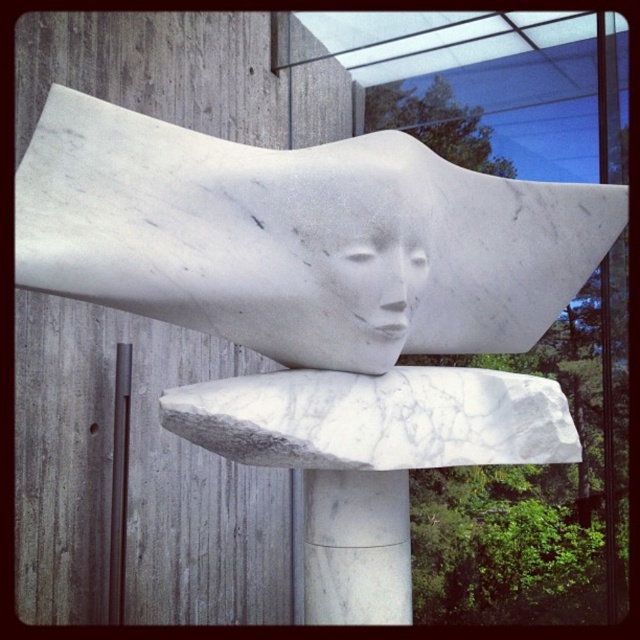
You are an art student analyzing the sculpture. You observe the white marble sculpture at center and the white marble face at center. Which one takes up more space in the image?

The white marble sculpture at center is larger in size than the white marble face at center, so it takes up more space in the image.

What is the location of the point with coordinates (300, 237) in the image?

The point with coordinates (300, 237) corresponds to the white marble sculpture at center.

You are an art student analyzing the sculpture. You notice two parts of the sculpture labeled as the white marble sculpture at center and the white marble face at center. Which part is wider?

The white marble sculpture at center is wider than the white marble face at center.